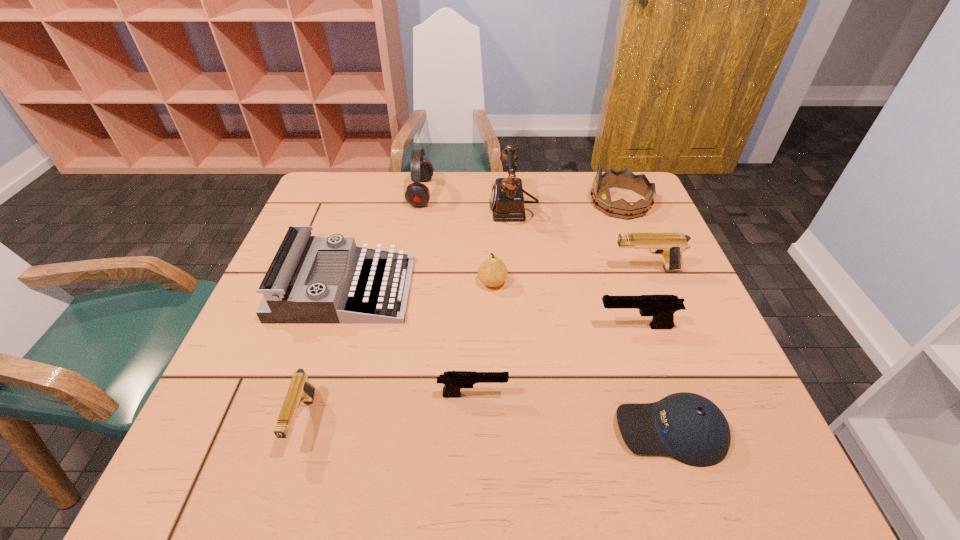
Find the location of a particular element. This screenshot has height=540, width=960. the nearer tan pistol is located at coordinates (300, 390).

What are the coordinates of `the left black pistol` in the screenshot? It's located at (453, 381).

Identify the location of the smaller black pistol. The width and height of the screenshot is (960, 540). (453, 381).

At what (x,y) coordinates should I click in order to perform the action: click on blue baseball cap. Please return your answer as a coordinate pair (x, y). Looking at the image, I should click on (689, 427).

Where is `vacant space located 0.140m on the front of the telephone at the rotary dial`? vacant space located 0.140m on the front of the telephone at the rotary dial is located at coordinates (443, 210).

Where is `free space located on the front of the telephone at the rotary dial`? This screenshot has width=960, height=540. free space located on the front of the telephone at the rotary dial is located at coordinates click(x=372, y=210).

At what (x,y) coordinates should I click in order to perform the action: click on vacant area located 0.170m on the front of the telephone at the rotary dial. Please return your answer as a coordinate pair (x, y). The height and width of the screenshot is (540, 960). Looking at the image, I should click on (432, 210).

Locate an element on the screen. vacant space located 0.090m on the ear cups of the earphone is located at coordinates (462, 193).

The height and width of the screenshot is (540, 960). Identify the location of free space located 0.300m at the front of the tiara with jewels. (491, 202).

Where is `free region located 0.090m at the front of the tiara with jewels`? The width and height of the screenshot is (960, 540). free region located 0.090m at the front of the tiara with jewels is located at coordinates (560, 202).